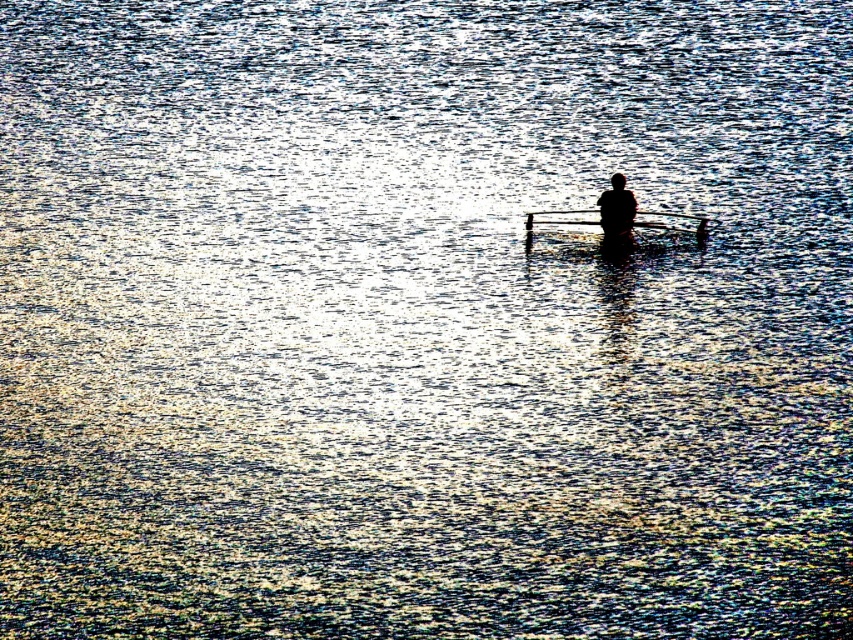
You are a photographer trying to capture the silhouette of the black matte figure at center and the smooth wood canoe at center in the same frame. Based on their positions, which object will appear closer to the bottom of the photo?

The smooth wood canoe at center appears closer to the bottom of the photo because it is positioned below the black matte figure at center.

You are a tourist planning to take a boat ride on the serene lake. You see the smooth wood canoe at center located at point (618, 227). Can you confirm the exact location of the smooth wood canoe at center?

The smooth wood canoe at center is exactly located at point (618, 227).

You are standing on the shore and see the smooth wood canoe at center and the transparent plastic paddle at center in the water. Which object is closer to the water surface?

A: The transparent plastic paddle at center is closer to the water surface because it is above the smooth wood canoe at center.